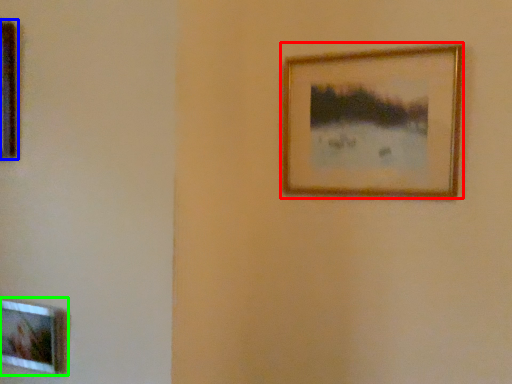
Question: Which is farther away from picture frame (highlighted by a red box)? picture frame (highlighted by a blue box) or picture frame (highlighted by a green box)?

Choices:
 (A) picture frame
 (B) picture frame

Answer: (B)